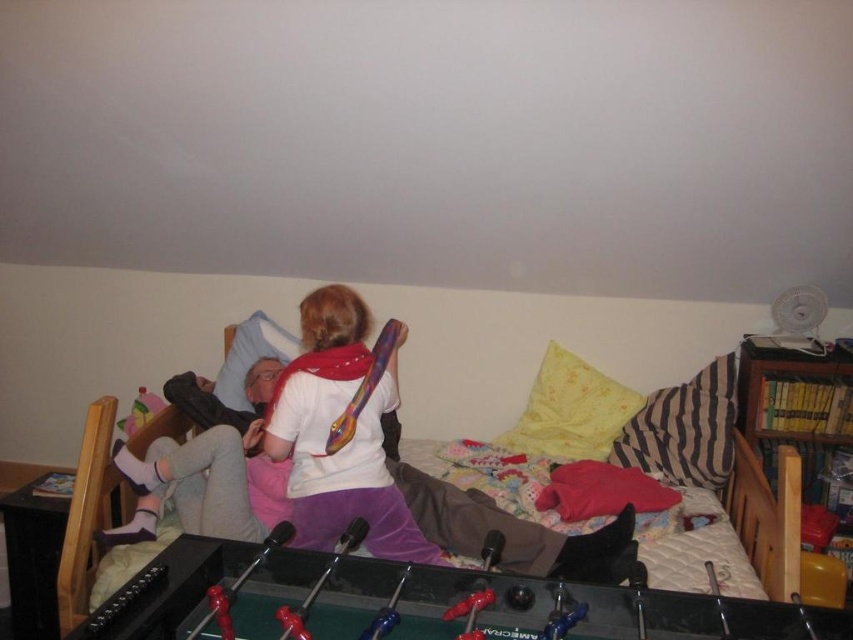
Consider the image. Who is higher up, soft cotton bed at center or white matte t-shirt at upper center?

white matte t-shirt at upper center

Which is below, soft cotton bed at center or white matte t-shirt at upper center?

soft cotton bed at center is lower down.

Is point (85, 493) positioned behind point (322, 448)?

No, it is in front of (322, 448).

The height and width of the screenshot is (640, 853). Identify the location of soft cotton bed at center. (200, 476).

Is black glossy foosball table at lower center to the right of white matte t-shirt at upper center from the viewer's perspective?

Indeed, black glossy foosball table at lower center is positioned on the right side of white matte t-shirt at upper center.

This screenshot has height=640, width=853. What do you see at coordinates (601, 611) in the screenshot?
I see `black glossy foosball table at lower center` at bounding box center [601, 611].

Between point (497, 596) and point (392, 536), which one is positioned behind?

The point (392, 536) is more distant.

At what (x,y) coordinates should I click in order to perform the action: click on black glossy foosball table at lower center. Please return your answer as a coordinate pair (x, y). The image size is (853, 640). Looking at the image, I should click on (601, 611).

Image resolution: width=853 pixels, height=640 pixels. Describe the element at coordinates (601, 611) in the screenshot. I see `black glossy foosball table at lower center` at that location.

Looking at this image, between black glossy foosball table at lower center and matte plastic toy at upper left, which one is positioned higher?

matte plastic toy at upper left is above.

Is point (445, 628) positioned before point (135, 412)?

Yes.

You are a GUI agent. You are given a task and a screenshot of the screen. Output one action in this format:
    pyautogui.click(x=<x>, y=<y>)
    Task: Click on the black glossy foosball table at lower center
    The height and width of the screenshot is (640, 853).
    Given the screenshot: What is the action you would take?
    pyautogui.click(x=601, y=611)